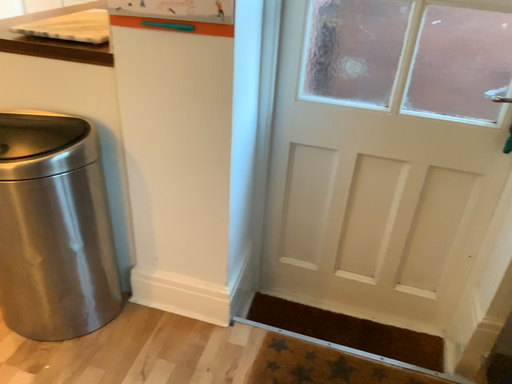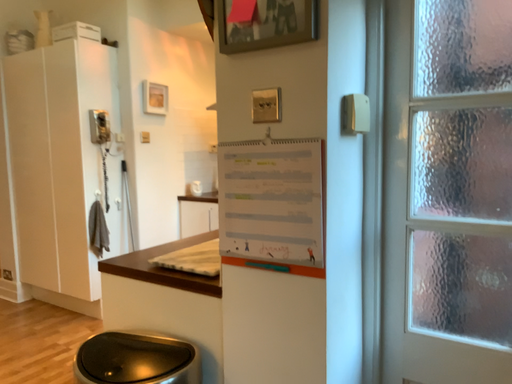
Question: Which way did the camera rotate in the video?

Choices:
 (A) rotated right
 (B) rotated left

Answer: (B)